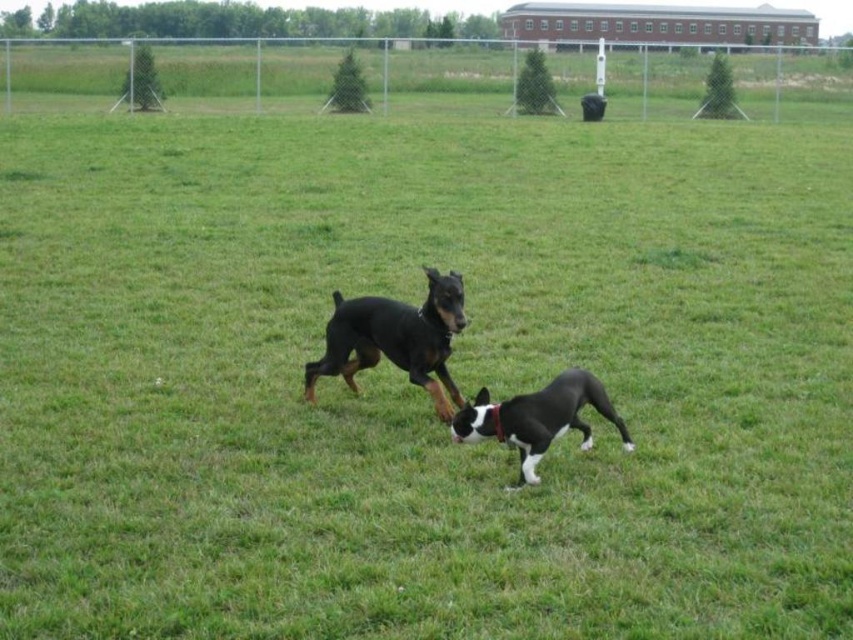
Question: Which point is farther to the camera?

Choices:
 (A) black matte dog at center
 (B) black smooth doberman at center

Answer: (B)

Question: Considering the relative positions of black smooth doberman at center and black matte dog at center in the image provided, where is black smooth doberman at center located with respect to black matte dog at center?

Choices:
 (A) right
 (B) left

Answer: (B)

Question: Can you confirm if black smooth doberman at center is smaller than black matte dog at center?

Choices:
 (A) yes
 (B) no

Answer: (B)

Question: Does black smooth doberman at center have a greater width compared to black matte dog at center?

Choices:
 (A) yes
 (B) no

Answer: (A)

Question: Which point is farther from the camera taking this photo?

Choices:
 (A) (355, 323)
 (B) (527, 406)

Answer: (A)